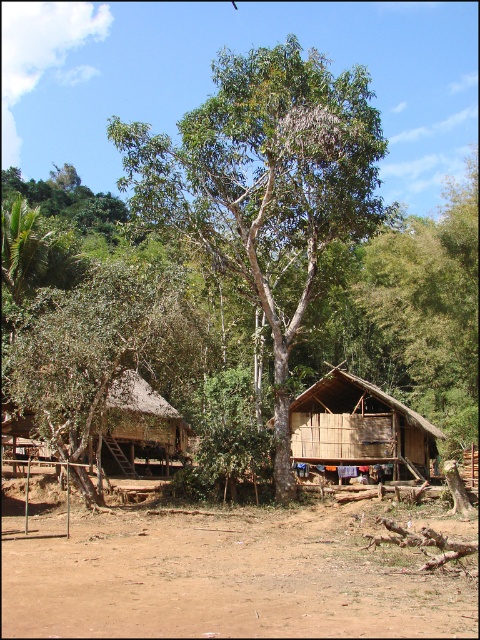
You are standing in the rural scene and want to place a small garden between the two points labeled point (243,227) and point (405,408). Which point should the garden be closer to if you want it to be in the foreground of the image?

The garden should be placed closer to point (243,227) because it is closer to the viewer than point (405,408), making it part of the foreground.

Looking at this image, you are standing at point (160, 376) and want to walk to the larger hut on the right. Is the tree blocking your path?

The tree is between the two huts, so it is blocking your path to the larger hut on the right.

You are a visitor standing between the two huts and notice a green leafy tree at center and a bamboo hut at center. Which object is positioned higher in the image?

The green leafy tree at center is located above the bamboo hut at center, so it is positioned higher in the image.